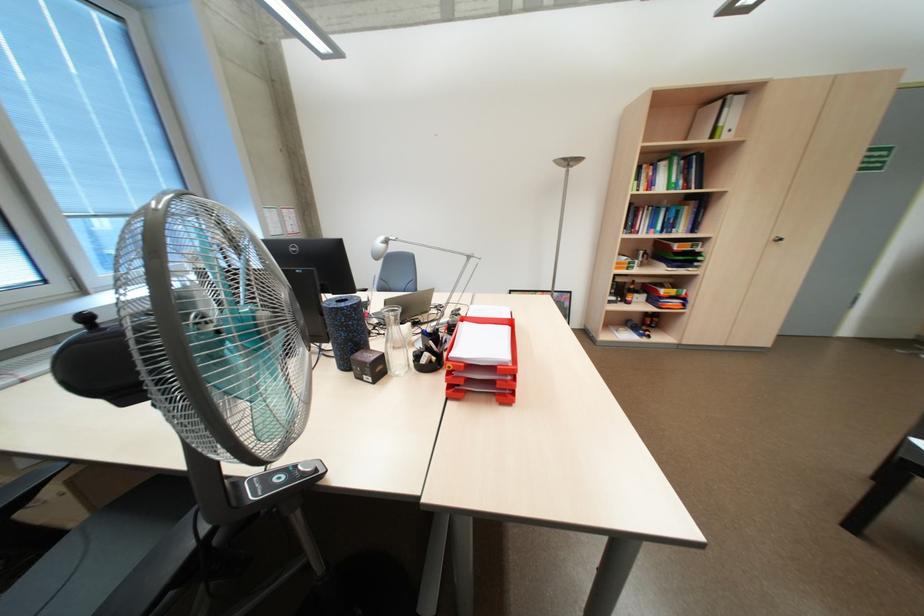
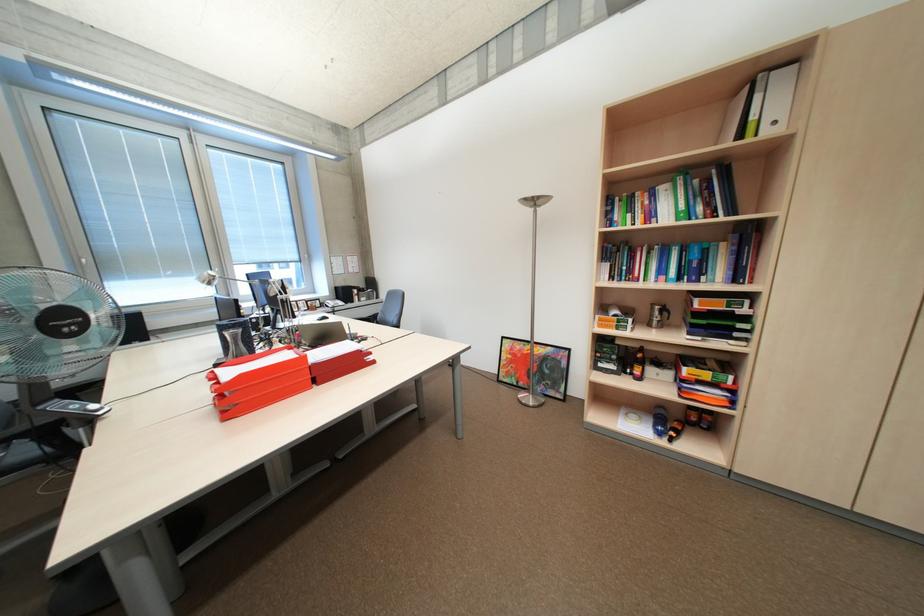
Question: I am providing you with two images of the same scene from different viewpoints. After the viewpoint changes to image2, which objects are now occluded?

Choices:
 (A) red file organizer
 (B) red binder pull-hole
 (C) fan control button
 (D) bottle on shelf

Answer: (D)